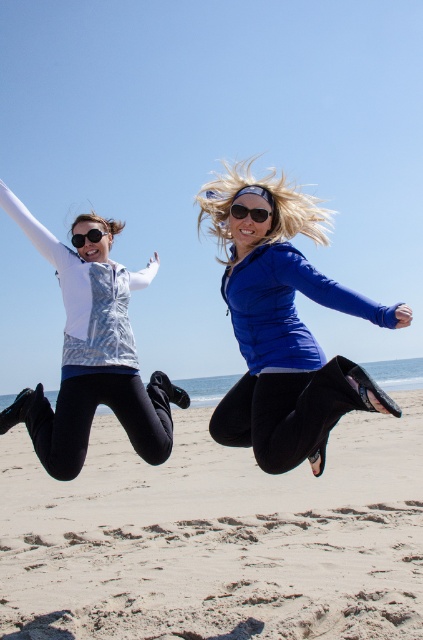
You are standing at the point labeled as point (216, 538) in the image. Looking around, you see two people jumping on the sandy beach at lower center. Which direction should you move to reach the sandy beach at lower center from your current position?

The point (216, 538) corresponds to the sandy beach at lower center, so you are already at the sandy beach at lower center.

You are standing at the point labeled as point (216, 538) in the image. Looking around, you see two people jumping on the sandy beach at lower center. Which direction should you move to reach the sandy beach at lower center?

The point labeled as point (216, 538) is already located on the sandy beach at lower center, so you are already there.

You are a photographer trying to capture the metallic silver vest at left and the sandy beach at lower center in the same frame. Based on their positions, which object should you focus on first to ensure both are in focus?

The metallic silver vest at left is closer to you than the sandy beach at lower center, so you should focus on the metallic silver vest at left first to ensure both are in focus.